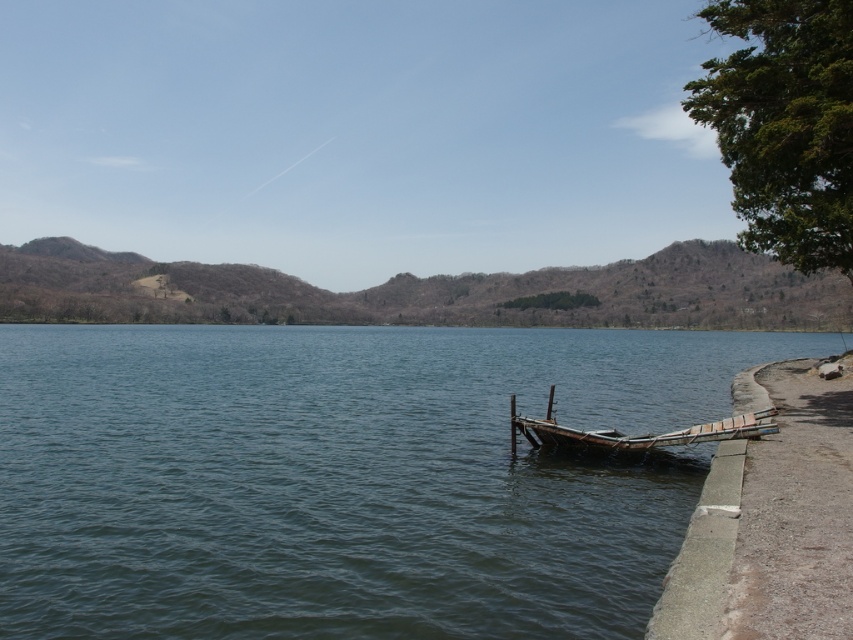
Based on the photo, does blue water at lower left have a lesser width compared to wooden boat at lower right?

No, blue water at lower left is not thinner than wooden boat at lower right.

Between blue water at lower left and wooden boat at lower right, which one is positioned lower?

wooden boat at lower right is lower down.

What do you see at coordinates (345, 477) in the screenshot? This screenshot has height=640, width=853. I see `blue water at lower left` at bounding box center [345, 477].

I want to click on blue water at lower left, so click(x=345, y=477).